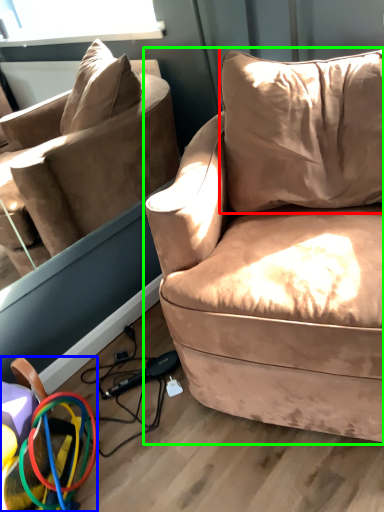
Question: Which is farther away from pillow (highlighted by a red box)? toy (highlighted by a blue box) or studio couch (highlighted by a green box)?

Choices:
 (A) toy
 (B) studio couch

Answer: (A)